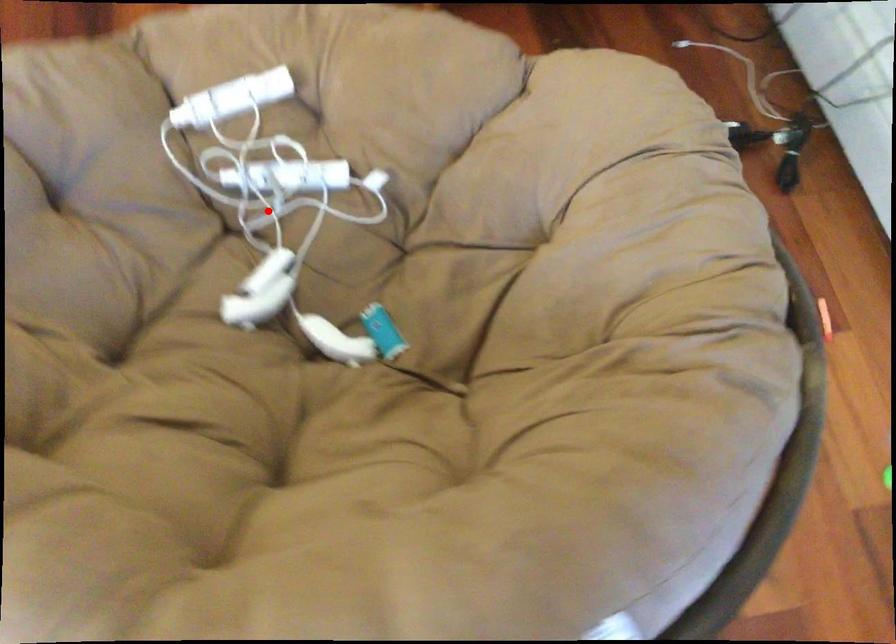
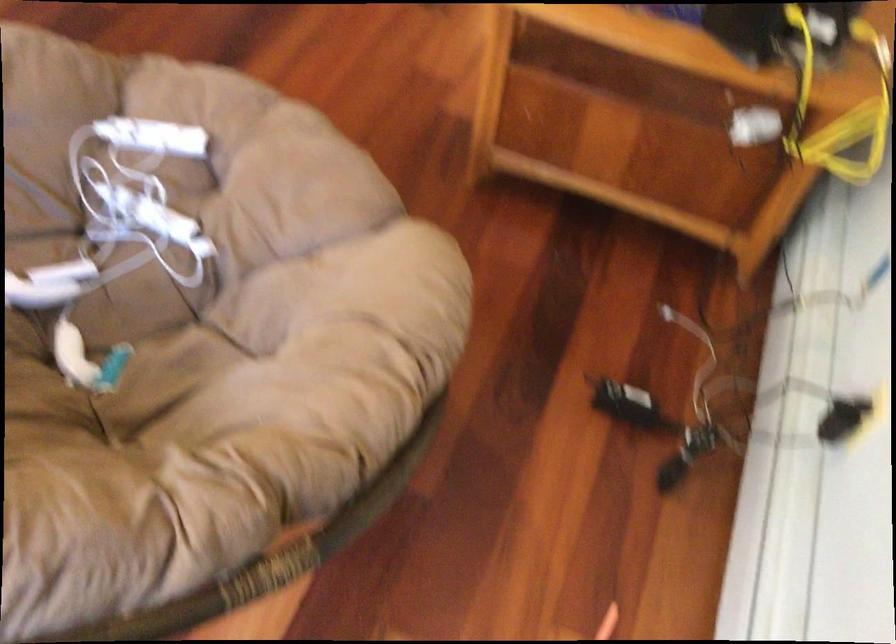
Question: I am providing you with two images of the same scene from different viewpoints. Given a red point in image1, look at the same physical point in image2. Is it:

Choices:
 (A) Closer to the viewpoint
 (B) Farther from the viewpoint

Answer: (B)